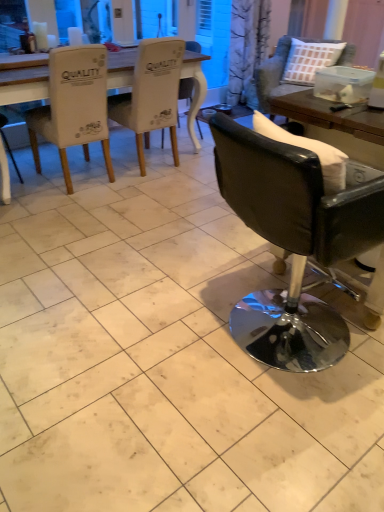
The height and width of the screenshot is (512, 384). I want to click on free space to the right of white fabric chair at upper left, the fifth chair viewed from the right, so click(x=144, y=191).